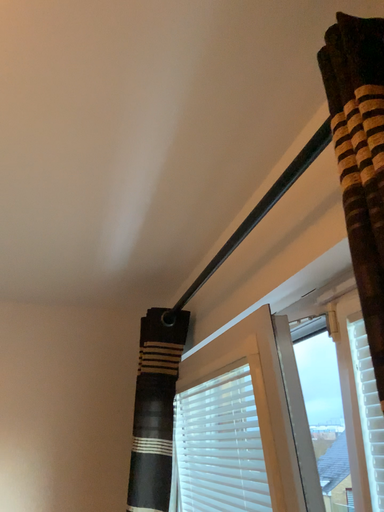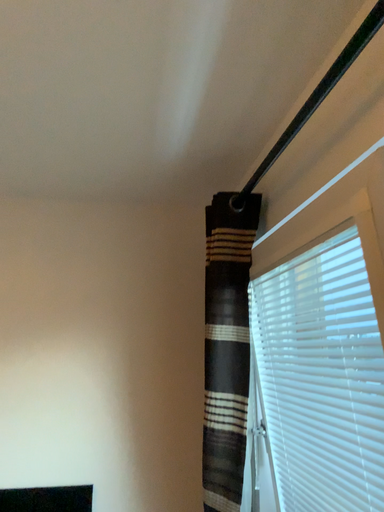
Question: How did the camera likely rotate when shooting the video?

Choices:
 (A) rotated left
 (B) rotated right

Answer: (A)